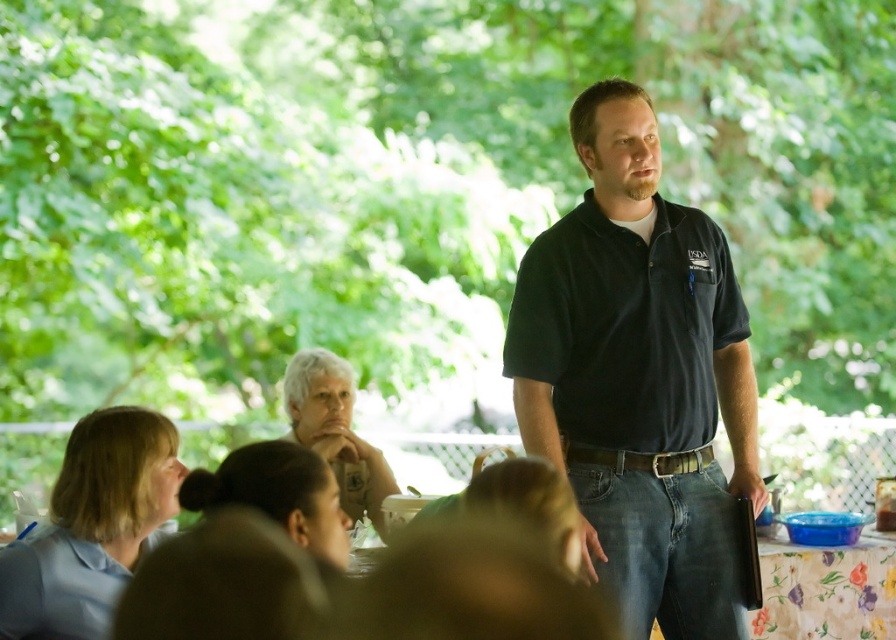
You are a photographer trying to capture a photo of the dark blue shirt at center and the floral fabric tablecloth at lower right. If you want to ensure both are in focus, which one should you focus on first based on their positions?

The dark blue shirt at center is above the floral fabric tablecloth at lower right, so you should focus on the dark blue shirt at center first to ensure both are in focus.

You are attending an outdoor meeting in a garden. You notice a black cotton polo shirt at center and a floral fabric tablecloth at lower right. Which object is located more to the left in the scene?

The black cotton polo shirt at center is positioned on the left side of the floral fabric tablecloth at lower right, so it is more to the left.

You are a person who is 1.7 meters tall and want to walk from the black cotton polo shirt at center to the floral fabric tablecloth at lower right. Is there enough space for you to walk through the area between them?

The distance between the black cotton polo shirt at center and the floral fabric tablecloth at lower right is 1.01 meters. Since you are 1.7 meters tall, the space is insufficient for you to walk through comfortably as the distance is shorter than your height.